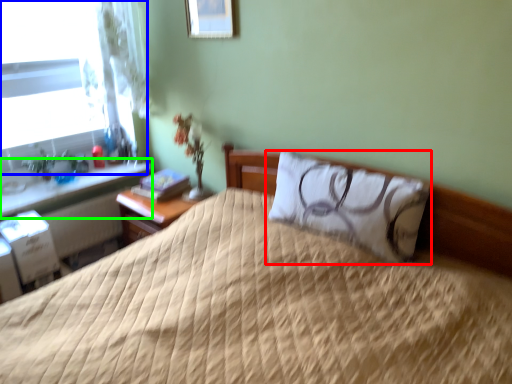
Question: Which is farther away from pillow (highlighted by a red box)? window (highlighted by a blue box) or window sill (highlighted by a green box)?

Choices:
 (A) window
 (B) window sill

Answer: (A)